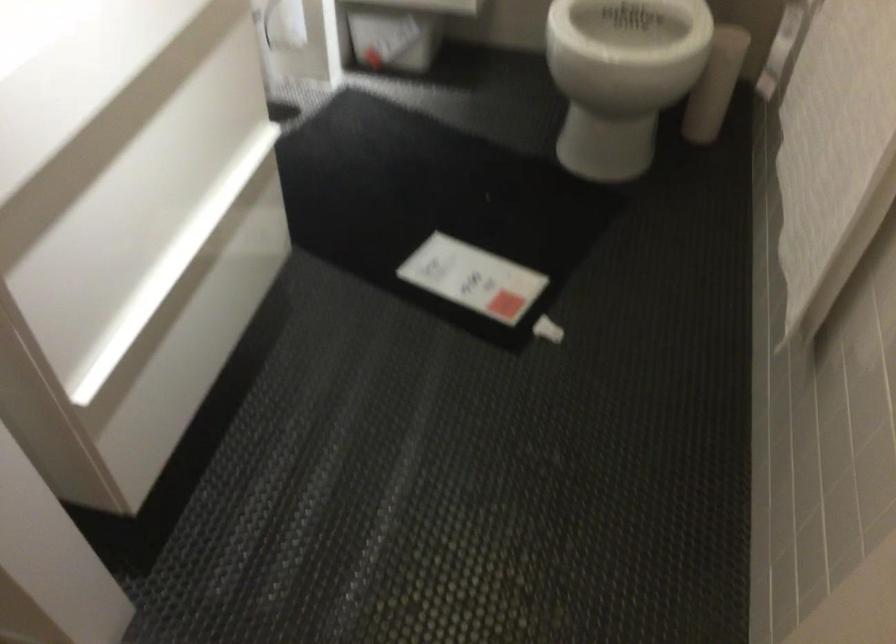
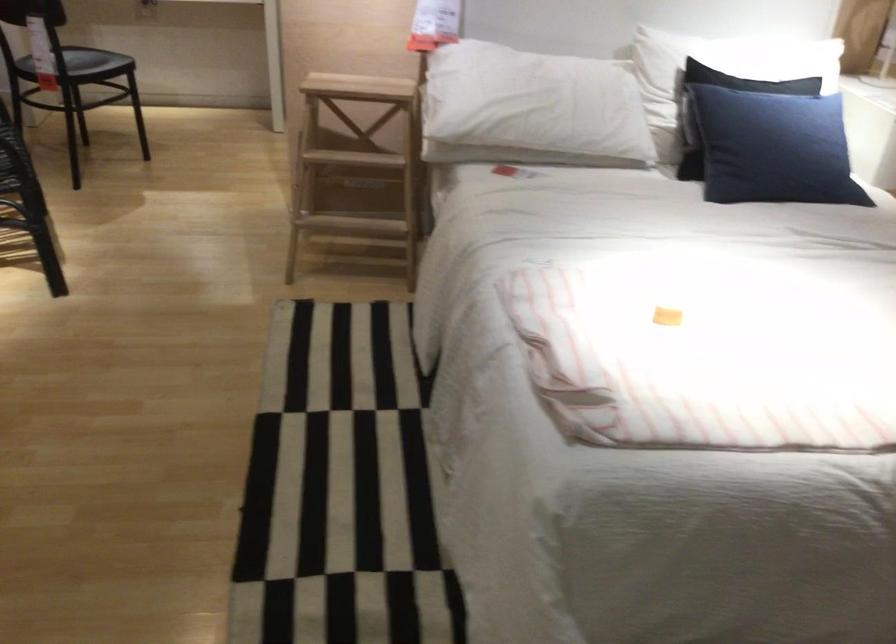
Question: I am providing you with two images of the same scene from different viewpoints. After the viewpoint changes to image2, which objects are now occluded?

Choices:
 (A) black pillow
 (B) black floor mat
 (C) blue pillow
 (D) white roll-on bottle

Answer: (B)